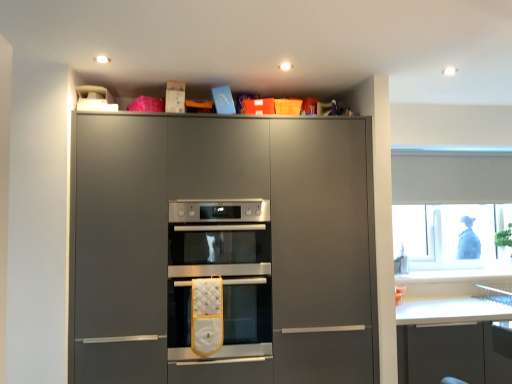
Question: Is matte gray oven at center aimed at transparent plastic window at upper right?

Choices:
 (A) yes
 (B) no

Answer: (B)

Question: Is matte gray oven at center directly adjacent to transparent plastic window at upper right?

Choices:
 (A) no
 (B) yes

Answer: (A)

Question: Is transparent plastic window at upper right a part of matte gray oven at center?

Choices:
 (A) yes
 (B) no

Answer: (B)

Question: From a real-world perspective, is matte gray oven at center located beneath transparent plastic window at upper right?

Choices:
 (A) no
 (B) yes

Answer: (B)

Question: Is matte gray oven at center bigger than transparent plastic window at upper right?

Choices:
 (A) no
 (B) yes

Answer: (B)

Question: From the image's perspective, is white quilted oven mitt at center, which is the first oven from bottom to top, above or below satin silver oven at center, which ranks as the second oven in bottom-to-top order?

Choices:
 (A) above
 (B) below

Answer: (B)

Question: From a real-world perspective, is white quilted oven mitt at center, which is the first oven from bottom to top, positioned above or below satin silver oven at center, which ranks as the second oven in bottom-to-top order?

Choices:
 (A) above
 (B) below

Answer: (B)

Question: Looking at their shapes, would you say white quilted oven mitt at center, the second oven viewed from the top, is wider or thinner than satin silver oven at center, which ranks as the second oven in bottom-to-top order?

Choices:
 (A) wide
 (B) thin

Answer: (A)

Question: In terms of size, does white quilted oven mitt at center, the second oven viewed from the top, appear bigger or smaller than satin silver oven at center, which ranks as the second oven in bottom-to-top order?

Choices:
 (A) small
 (B) big

Answer: (B)

Question: Is matte gray oven at center taller or shorter than white quilted oven mitt at center, which is the first oven from bottom to top?

Choices:
 (A) tall
 (B) short

Answer: (A)

Question: Is point (364, 215) closer or farther from the camera than point (266, 332)?

Choices:
 (A) closer
 (B) farther

Answer: (B)

Question: From a real-world perspective, relative to white quilted oven mitt at center, the second oven viewed from the top, is matte gray oven at center vertically above or below?

Choices:
 (A) below
 (B) above

Answer: (B)

Question: Based on their sizes in the image, would you say matte gray oven at center is bigger or smaller than white quilted oven mitt at center, the second oven viewed from the top?

Choices:
 (A) small
 (B) big

Answer: (B)

Question: In terms of size, does satin silver oven at center, placed as the 1th oven when sorted from top to bottom, appear bigger or smaller than white quilted oven mitt at center, the second oven viewed from the top?

Choices:
 (A) small
 (B) big

Answer: (A)

Question: From the image's perspective, is satin silver oven at center, placed as the 1th oven when sorted from top to bottom, above or below white quilted oven mitt at center, the second oven viewed from the top?

Choices:
 (A) below
 (B) above

Answer: (B)